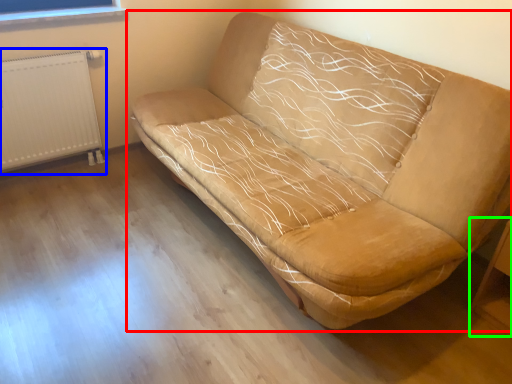
Question: Which is farther away from studio couch (highlighted by a red box)? radiator (highlighted by a blue box) or table (highlighted by a green box)?

Choices:
 (A) radiator
 (B) table

Answer: (A)